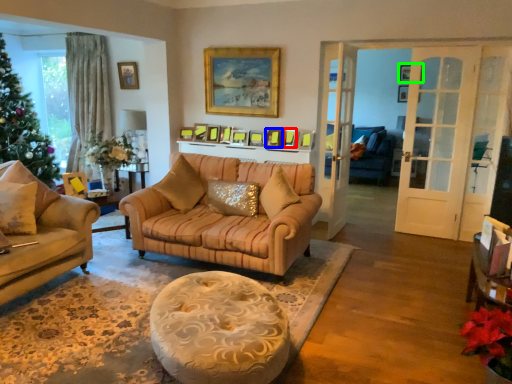
Question: Based on their relative distances, which object is farther from picture frame (highlighted by a red box)? Choose from picture frame (highlighted by a blue box) and picture frame (highlighted by a green box).

Choices:
 (A) picture frame
 (B) picture frame

Answer: (B)